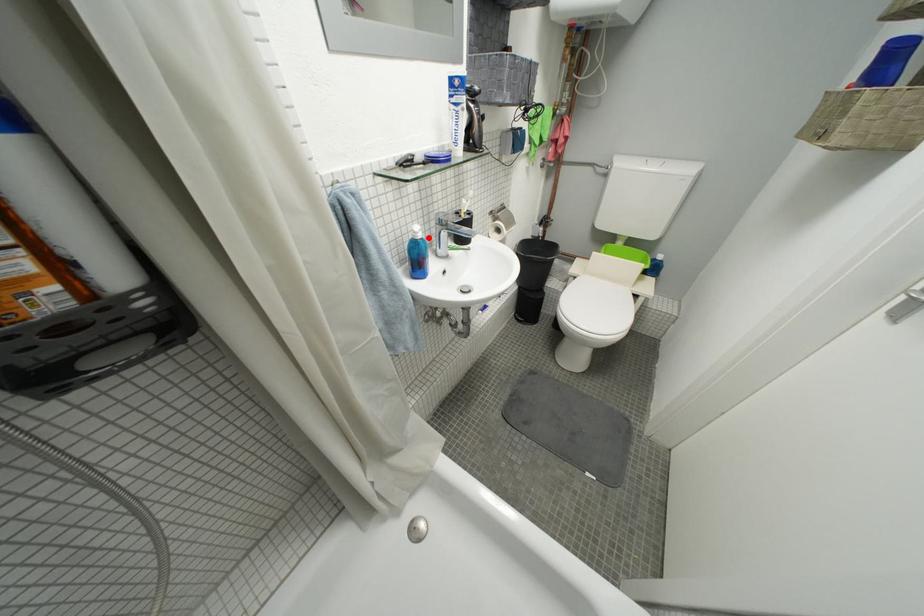
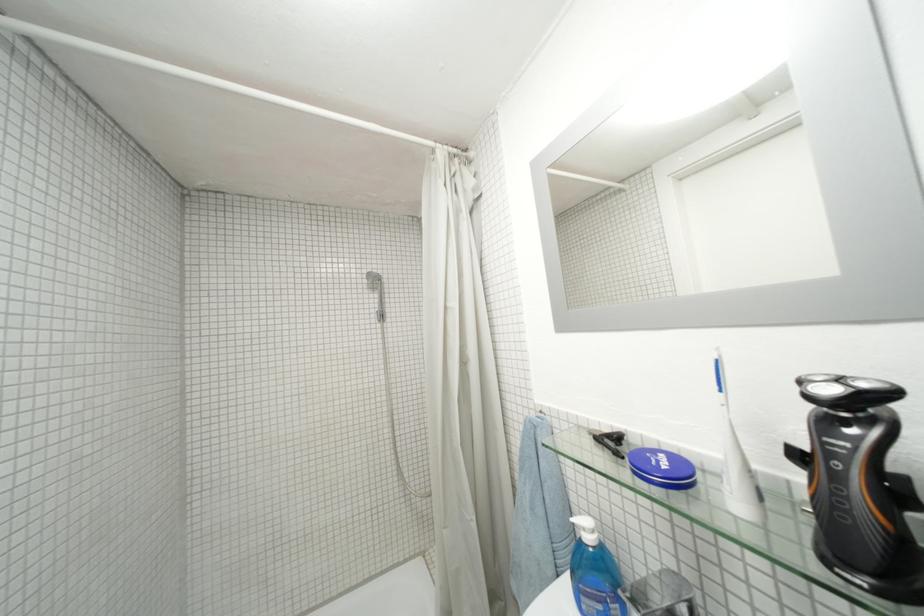
Question: I am providing you with two images of the same scene from different viewpoints. A red point is marked on the first image. Can you still see the location of the red point in image 2?

Choices:
 (A) Yes
 (B) No

Answer: (A)